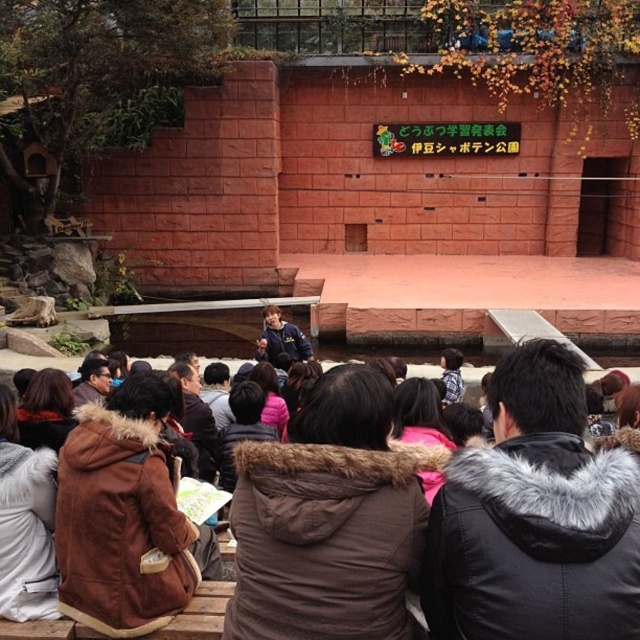
Between point (637, 573) and point (515, 579), which one is positioned in front?

Point (515, 579)

Which of these two, black fur-lined jacket at lower right or brown fur-lined coat at center, stands taller?

Standing taller between the two is black fur-lined jacket at lower right.

Which is in front, point (572, 388) or point (493, 518)?

Point (493, 518) is in front.

Find the location of a particular element. black fur-lined jacket at lower right is located at coordinates (534, 516).